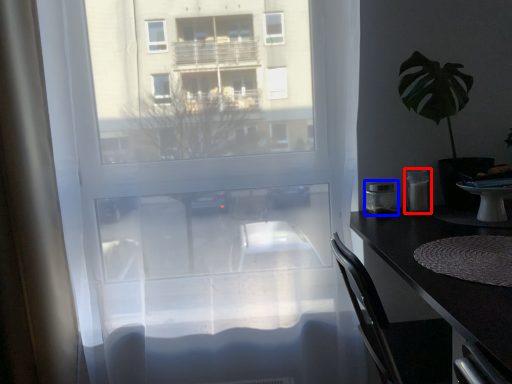
Question: Which of the following is the farthest to the observer, appliance (highlighted by a red box) or appliance (highlighted by a blue box)?

Choices:
 (A) appliance
 (B) appliance

Answer: (B)